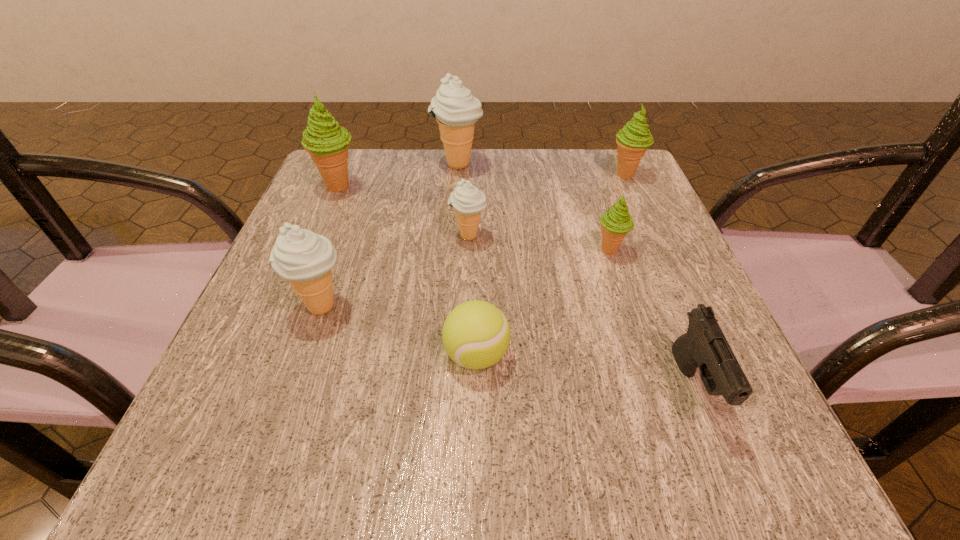
This screenshot has height=540, width=960. What are the coordinates of `tennis ball` in the screenshot? It's located at pyautogui.click(x=476, y=334).

Image resolution: width=960 pixels, height=540 pixels. Identify the location of free space located 0.170m on the front of the biggest beige icecream. [x=454, y=222].

Identify the location of vacant space situated on the right of the biggest green icecream. The height and width of the screenshot is (540, 960). (450, 186).

This screenshot has width=960, height=540. What are the coordinates of `free location located 0.070m on the front of the rightmost icecream` in the screenshot? It's located at (638, 202).

I want to click on vacant space located on the back of the leftmost beige icecream, so click(354, 211).

Image resolution: width=960 pixels, height=540 pixels. I want to click on blank area located on the left of the smallest beige icecream, so click(326, 237).

Find the location of a particular element. free space located on the left of the second green icecream from right to left is located at coordinates (413, 251).

Where is `vacant space located at the barrel of the black pistol`? vacant space located at the barrel of the black pistol is located at coordinates (737, 493).

Where is `vacant area situated on the left of the green tennis ball`? vacant area situated on the left of the green tennis ball is located at coordinates (377, 355).

Find the location of `object that is at the near edge`. object that is at the near edge is located at coordinates (704, 345).